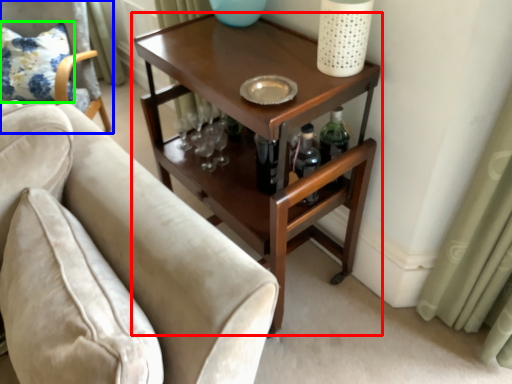
Question: Estimate the real-world distances between objects in this image. Which object is farther from table (highlighted by a red box), chair (highlighted by a blue box) or pillow (highlighted by a green box)?

Choices:
 (A) chair
 (B) pillow

Answer: (B)